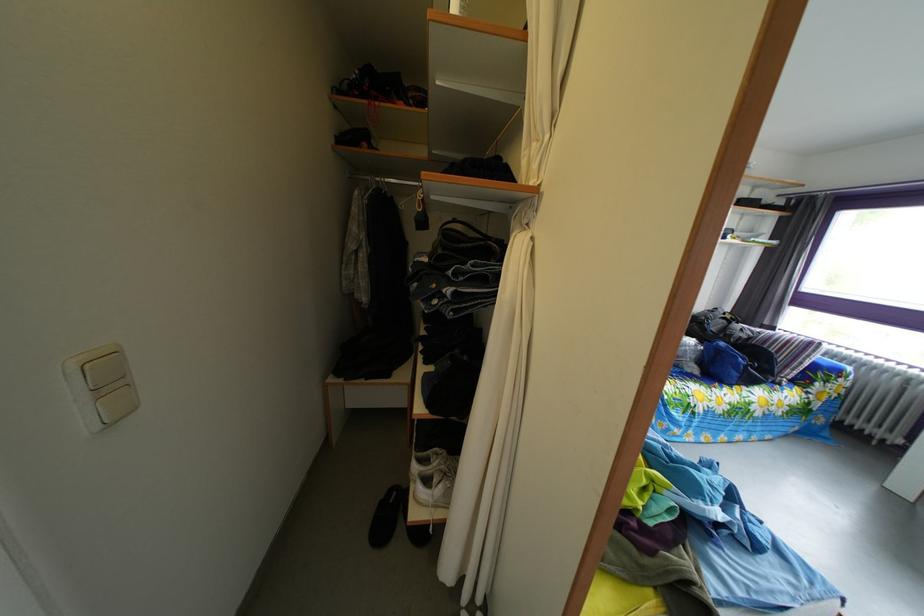
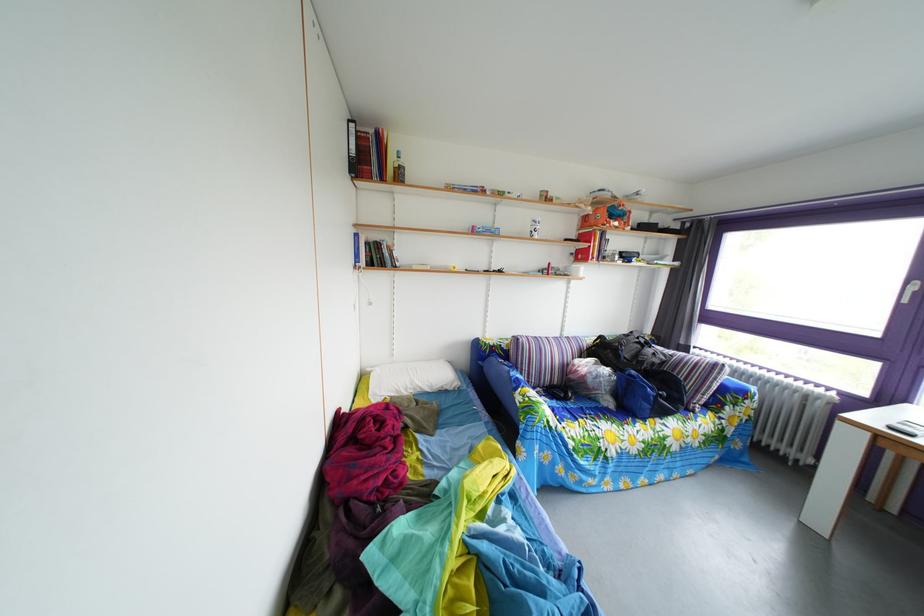
Question: The camera is either moving clockwise (left) or counter-clockwise (right) around the object. The first image is from the beginning of the video and the second image is from the end. Is the camera moving left or right when shooting the video?

Choices:
 (A) Left
 (B) Right

Answer: (A)